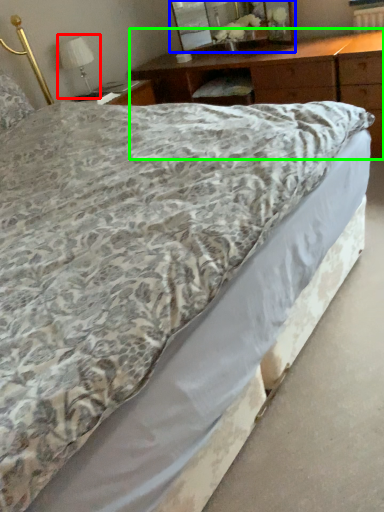
Question: Which is farther away from table lamp (highlighted by a red box)? mirror (highlighted by a blue box) or nightstand (highlighted by a green box)?

Choices:
 (A) mirror
 (B) nightstand

Answer: (A)